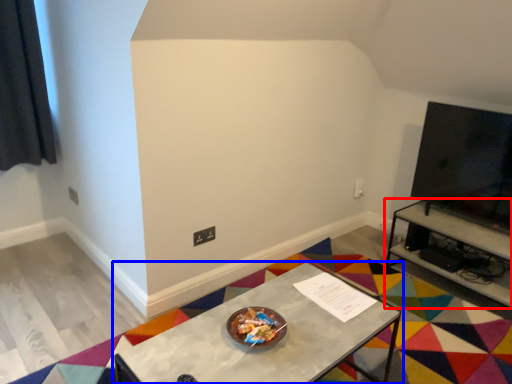
Question: Among these objects, which one is nearest to the camera, table (highlighted by a red box) or table (highlighted by a blue box)?

Choices:
 (A) table
 (B) table

Answer: (B)